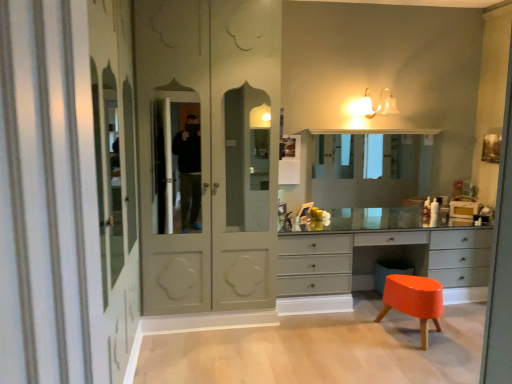
Question: Can you confirm if matte gray chest of drawers at center is thinner than matte glass sconce at upper center?

Choices:
 (A) no
 (B) yes

Answer: (A)

Question: Does matte gray chest of drawers at center appear on the right side of matte glass sconce at upper center?

Choices:
 (A) no
 (B) yes

Answer: (B)

Question: Is matte gray chest of drawers at center closer to camera compared to matte glass sconce at upper center?

Choices:
 (A) no
 (B) yes

Answer: (B)

Question: From a real-world perspective, is matte gray chest of drawers at center positioned over matte glass sconce at upper center based on gravity?

Choices:
 (A) no
 (B) yes

Answer: (A)

Question: Does matte gray chest of drawers at center have a lesser height compared to matte glass sconce at upper center?

Choices:
 (A) yes
 (B) no

Answer: (B)

Question: Considering the relative sizes of matte gray chest of drawers at center and matte glass sconce at upper center in the image provided, is matte gray chest of drawers at center wider than matte glass sconce at upper center?

Choices:
 (A) no
 (B) yes

Answer: (B)

Question: From the image's perspective, is matte glass sconce at upper center beneath matte gray chest of drawers at center?

Choices:
 (A) no
 (B) yes

Answer: (A)

Question: Would you say matte gray chest of drawers at center is part of matte glass sconce at upper center's contents?

Choices:
 (A) yes
 (B) no

Answer: (B)

Question: Is matte glass sconce at upper center smaller than matte gray chest of drawers at center?

Choices:
 (A) no
 (B) yes

Answer: (B)

Question: Could you tell me if matte glass sconce at upper center is turned towards matte gray chest of drawers at center?

Choices:
 (A) yes
 (B) no

Answer: (B)

Question: Is there a large distance between matte glass sconce at upper center and matte gray chest of drawers at center?

Choices:
 (A) no
 (B) yes

Answer: (B)

Question: Is matte gray chest of drawers at center at the back of matte glass sconce at upper center?

Choices:
 (A) yes
 (B) no

Answer: (B)

Question: Is the position of matte glass sconce at upper center more distant than that of matte white wardrobe at center?

Choices:
 (A) yes
 (B) no

Answer: (A)